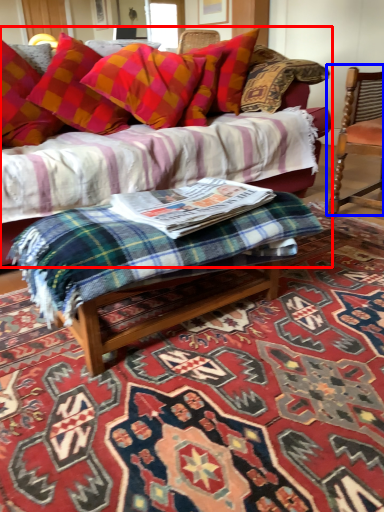
Question: Which object appears closest to the camera in this image, studio couch (highlighted by a red box) or chair (highlighted by a blue box)?

Choices:
 (A) studio couch
 (B) chair

Answer: (A)